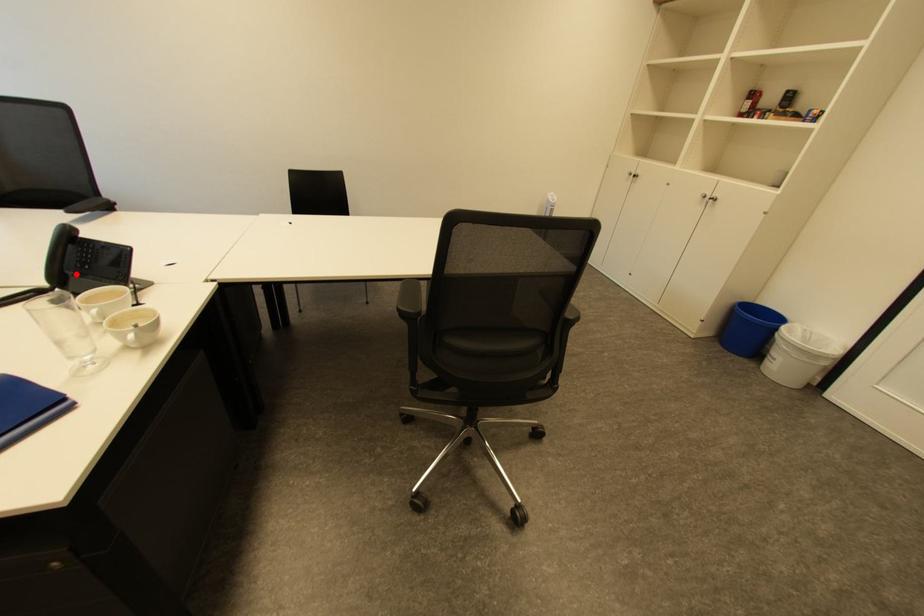
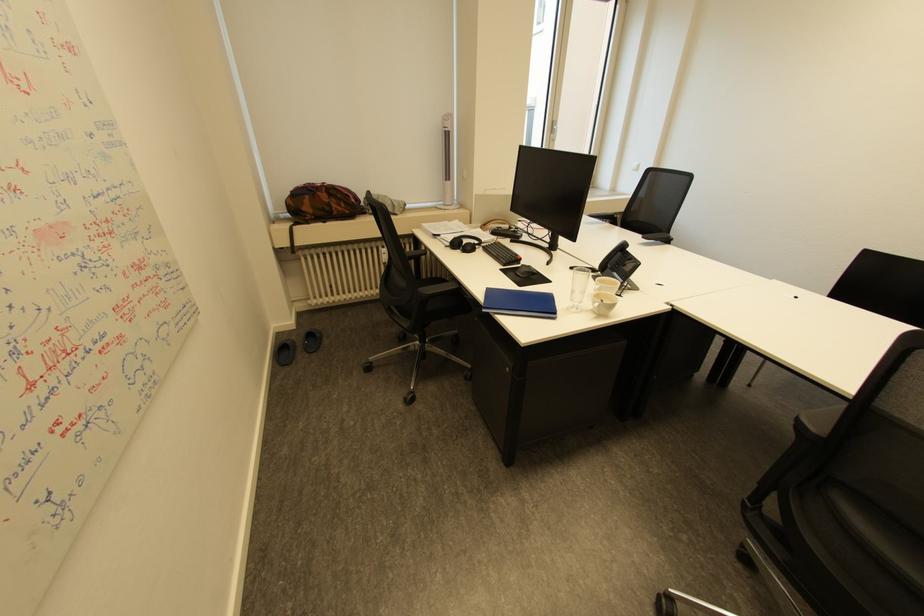
Question: I am providing you with two images of the same scene from different viewpoints. A red point is shown in image1. For the corresponding object point in image2, is it positioned nearer or farther from the camera?

Choices:
 (A) Nearer
 (B) Farther

Answer: (A)